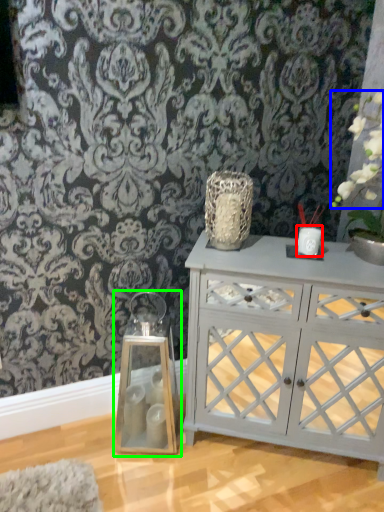
Question: Which is nearer to the candle holder (highlighted by a red box)? floral arrangement (highlighted by a blue box) or candle holder (highlighted by a green box).

Choices:
 (A) floral arrangement
 (B) candle holder

Answer: (A)